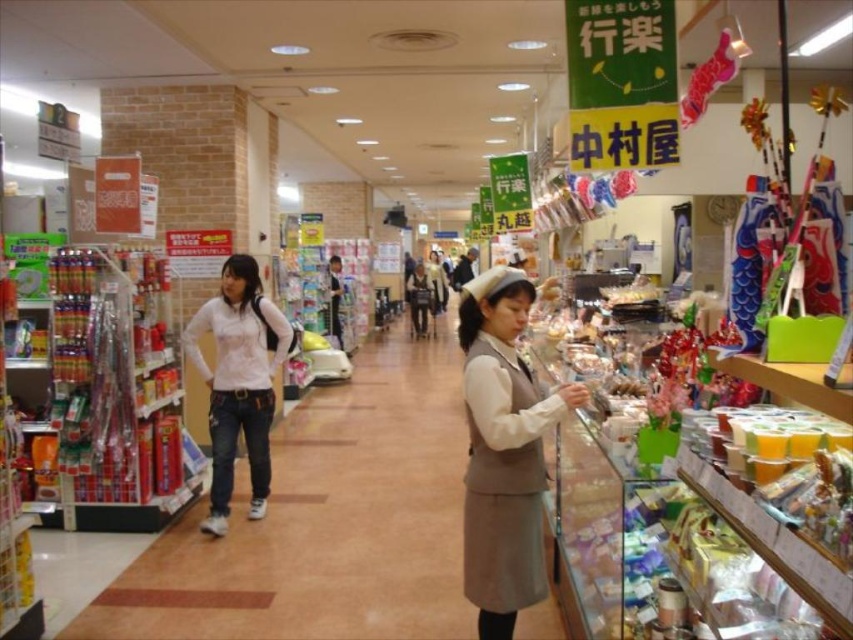
Is denim jeans at left to the right of beige woolen dress at center from the viewer's perspective?

In fact, denim jeans at left is to the left of beige woolen dress at center.

Measure the distance between denim jeans at left and beige woolen dress at center.

denim jeans at left and beige woolen dress at center are 2.26 meters apart from each other.

Which is in front, point (396, 394) or point (519, 275)?

Point (519, 275) is more forward.

I want to click on denim jeans at left, so click(325, 522).

Which is below, denim jeans at left or white matte shirt at center?

denim jeans at left is lower down.

Does point (361, 464) lie in front of point (231, 273)?

That is False.

I want to click on denim jeans at left, so click(325, 522).

Does beige woolen dress at center have a greater width compared to white matte shirt at center?

No, beige woolen dress at center is not wider than white matte shirt at center.

Is beige woolen dress at center closer to the viewer compared to white matte shirt at center?

Yes, beige woolen dress at center is in front of white matte shirt at center.

What are the coordinates of `beige woolen dress at center` in the screenshot? It's located at (503, 451).

Where is `beige woolen dress at center`? This screenshot has height=640, width=853. beige woolen dress at center is located at coordinates (503, 451).